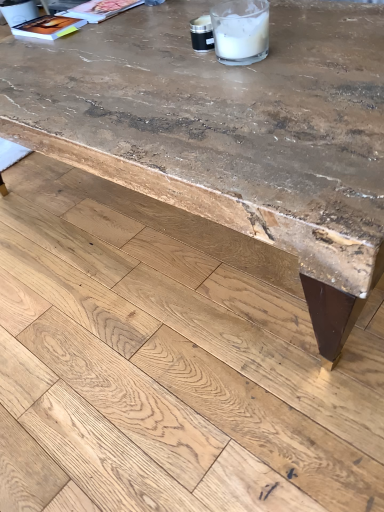
Question: Does matte paper magazine at upper left, which ranks as the second magazine in left-to-right order, come in front of rough concrete table at upper center?

Choices:
 (A) no
 (B) yes

Answer: (A)

Question: Is matte paper magazine at upper left, which ranks as the second magazine in left-to-right order, far away from rough concrete table at upper center?

Choices:
 (A) no
 (B) yes

Answer: (A)

Question: Is rough concrete table at upper center at the back of matte paper magazine at upper left, the 1th magazine when ordered from right to left?

Choices:
 (A) yes
 (B) no

Answer: (B)

Question: Is rough concrete table at upper center inside matte paper magazine at upper left, which ranks as the second magazine in left-to-right order?

Choices:
 (A) no
 (B) yes

Answer: (A)

Question: From a real-world perspective, is matte paper magazine at upper left, the 1th magazine when ordered from right to left, under rough concrete table at upper center?

Choices:
 (A) no
 (B) yes

Answer: (A)

Question: Considering the positions of point (334, 121) and point (243, 56), is point (334, 121) closer or farther from the camera than point (243, 56)?

Choices:
 (A) closer
 (B) farther

Answer: (A)

Question: Based on their sizes in the image, would you say rustic wood table at center is bigger or smaller than clear plastic straw at upper center?

Choices:
 (A) big
 (B) small

Answer: (A)

Question: Considering their positions, is rustic wood table at center located in front of or behind clear plastic straw at upper center?

Choices:
 (A) front
 (B) behind

Answer: (A)

Question: Is rustic wood table at center taller or shorter than clear plastic straw at upper center?

Choices:
 (A) short
 (B) tall

Answer: (B)

Question: In the image, is clear plastic straw at upper center on the left side or the right side of rustic wood table at center?

Choices:
 (A) right
 (B) left

Answer: (A)

Question: Is clear plastic straw at upper center inside the boundaries of rustic wood table at center, or outside?

Choices:
 (A) inside
 (B) outside

Answer: (B)

Question: Is clear plastic straw at upper center taller or shorter than rustic wood table at center?

Choices:
 (A) short
 (B) tall

Answer: (A)

Question: From the image's perspective, is clear plastic straw at upper center positioned above or below rustic wood table at center?

Choices:
 (A) below
 (B) above

Answer: (B)

Question: In terms of width, does rough concrete table at upper center look wider or thinner when compared to matte paper magazine at upper left, the 1th magazine when ordered from right to left?

Choices:
 (A) wide
 (B) thin

Answer: (A)

Question: Relative to matte paper magazine at upper left, which ranks as the second magazine in left-to-right order, is rough concrete table at upper center in front or behind?

Choices:
 (A) front
 (B) behind

Answer: (A)